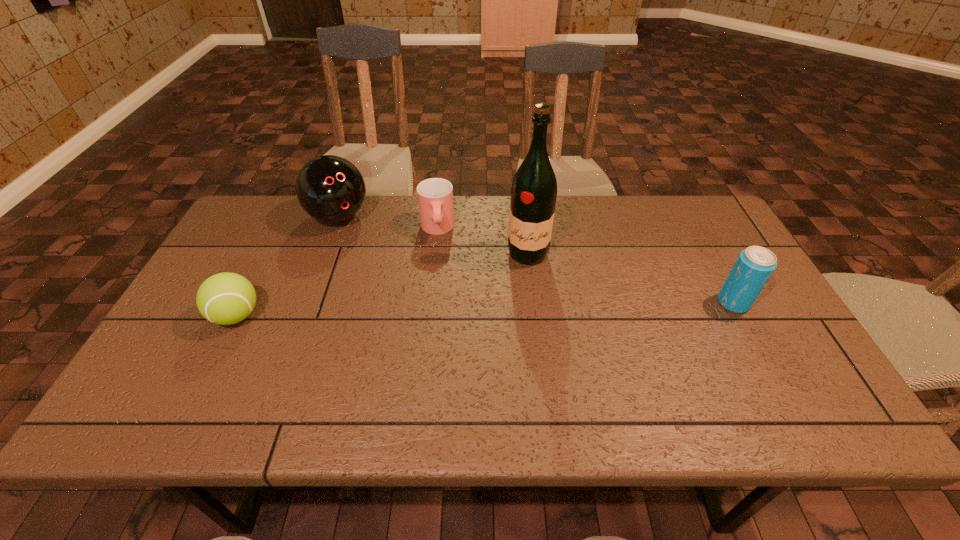
Locate an element on the screen. The image size is (960, 540). blank region between the fourth object from right to left and the cup is located at coordinates 388,222.

Locate an element on the screen. Image resolution: width=960 pixels, height=540 pixels. empty location between the leftmost object and the third object from left to right is located at coordinates (337, 272).

This screenshot has width=960, height=540. I want to click on vacant area that lies between the liquor and the tennis ball, so click(382, 285).

Where is `unoccupied area between the fourth object from right to left and the tennis ball`? This screenshot has height=540, width=960. unoccupied area between the fourth object from right to left and the tennis ball is located at coordinates (288, 266).

Identify the location of free space between the tennis ball and the rightmost object. The height and width of the screenshot is (540, 960). (485, 309).

Where is `unoccupied position between the cup and the leftmost object`? unoccupied position between the cup and the leftmost object is located at coordinates (337, 272).

Locate an element on the screen. The image size is (960, 540). vacant area that lies between the leftmost object and the third object from right to left is located at coordinates (337, 272).

The image size is (960, 540). What are the coordinates of `vacant area that lies between the tennis ball and the cup` in the screenshot? It's located at (337, 272).

Find the location of a particular element. This screenshot has height=540, width=960. object identified as the third closest to the tallest object is located at coordinates (754, 266).

Locate which object ranks in proximity to the fourth object from right to left. Please provide its 2D coordinates. Your answer should be formatted as a tuple, i.e. [(x, y)], where the tuple contains the x and y coordinates of a point satisfying the conditions above.

[(435, 195)]